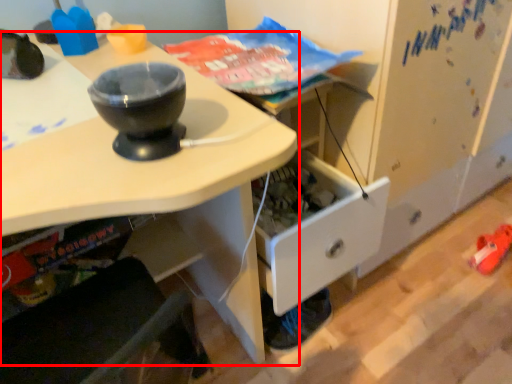
Question: From the image's perspective, what is the correct spatial positioning of desk (annotated by the red box) in reference to footwear?

Choices:
 (A) above
 (B) below

Answer: (A)